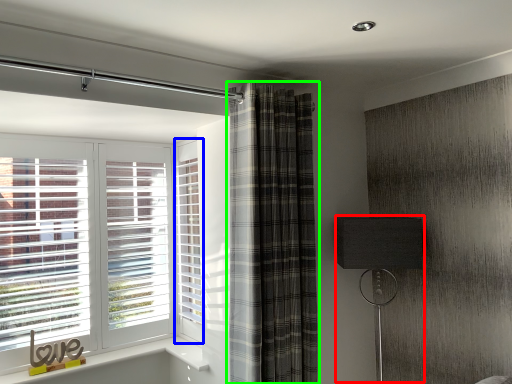
Question: Based on their relative distances, which object is farther from table lamp (highlighted by a red box)? Choose from screen door (highlighted by a blue box) and curtain (highlighted by a green box).

Choices:
 (A) screen door
 (B) curtain

Answer: (A)